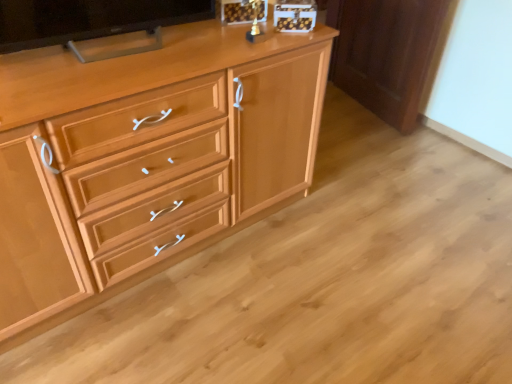
Where is `light wood cabinet at center`? The image size is (512, 384). light wood cabinet at center is located at coordinates (145, 160).

Describe the element at coordinates (89, 19) in the screenshot. I see `matte black tv at upper left` at that location.

Describe the element at coordinates (388, 53) in the screenshot. Image resolution: width=512 pixels, height=384 pixels. I see `light brown wood cabinet at right` at that location.

You are a GUI agent. You are given a task and a screenshot of the screen. Output one action in this format:
    pyautogui.click(x=<x>, y=<y>)
    Task: Click on the light wood cabinet at center
    This screenshot has width=512, height=384.
    Given the screenshot: What is the action you would take?
    pyautogui.click(x=145, y=160)

Is light wood cabinet at center taller or shorter than matte black tv at upper left?

Clearly, light wood cabinet at center is taller compared to matte black tv at upper left.

You are a GUI agent. You are given a task and a screenshot of the screen. Output one action in this format:
    pyautogui.click(x=<x>, y=<y>)
    Task: Click on the television lying above the light wood cabinet at center (from the image's perspective)
    
    Given the screenshot: What is the action you would take?
    pyautogui.click(x=89, y=19)

Are light wood cabinet at center and matte black tv at upper left making contact?

No, light wood cabinet at center is not making contact with matte black tv at upper left.

From the image's perspective, which is below, light brown wood cabinet at right or matte black tv at upper left?

matte black tv at upper left, from the image's perspective.

Is light brown wood cabinet at right directly adjacent to matte black tv at upper left?

light brown wood cabinet at right and matte black tv at upper left are clearly separated.

Based on the photo, how distant is light brown wood cabinet at right from matte black tv at upper left?

They are 1.53 meters apart.

Considering the relative sizes of light brown wood cabinet at right and matte black tv at upper left in the image provided, is light brown wood cabinet at right bigger than matte black tv at upper left?

Yes.

Is point (157, 22) less distant than point (225, 50)?

No, it is behind (225, 50).

Are matte black tv at upper left and light wood cabinet at center located far from each other?

matte black tv at upper left is near light wood cabinet at center, not far away.

How many degrees apart are the facing directions of matte black tv at upper left and light wood cabinet at center?

There is a 7.38-degree angle between the facing directions of matte black tv at upper left and light wood cabinet at center.

Is matte black tv at upper left to the right of light wood cabinet at center from the viewer's perspective?

In fact, matte black tv at upper left is to the left of light wood cabinet at center.

Which is closer, (401, 71) or (198, 132)?

The point (198, 132) is closer.

How many degrees apart are the facing directions of light brown wood cabinet at right and light wood cabinet at center?

101 degrees.

Is light brown wood cabinet at right facing away from light wood cabinet at center?

No, light brown wood cabinet at right is not facing away from light wood cabinet at center.

Consider the image. From a real-world perspective, is light brown wood cabinet at right on light wood cabinet at center?

Actually, light brown wood cabinet at right is physically below light wood cabinet at center in the real world.

Is matte black tv at upper left aimed at light brown wood cabinet at right?

No, matte black tv at upper left is not oriented towards light brown wood cabinet at right.

Is matte black tv at upper left closer to camera compared to light brown wood cabinet at right?

Yes.

Considering the sizes of objects matte black tv at upper left and light brown wood cabinet at right in the image provided, who is bigger, matte black tv at upper left or light brown wood cabinet at right?

With larger size is light brown wood cabinet at right.

Are matte black tv at upper left and light brown wood cabinet at right located far from each other?

matte black tv at upper left is positioned a significant distance from light brown wood cabinet at right.

Do you think light wood cabinet at center is within light brown wood cabinet at right, or outside of it?

light wood cabinet at center is not inside light brown wood cabinet at right, it's outside.

Is light wood cabinet at center not near light brown wood cabinet at right?

That's right, there is a large distance between light wood cabinet at center and light brown wood cabinet at right.

Is light wood cabinet at center at the left side of light brown wood cabinet at right?

Yes, light wood cabinet at center is to the left of light brown wood cabinet at right.

Where is `television above the light wood cabinet at center (from the image's perspective)`? television above the light wood cabinet at center (from the image's perspective) is located at coordinates (89, 19).

Find the location of `cabinetry to the right of matte black tv at upper left`. cabinetry to the right of matte black tv at upper left is located at coordinates (388, 53).

Based on their spatial positions, is light brown wood cabinet at right or matte black tv at upper left closer to light wood cabinet at center?

matte black tv at upper left lies closer to light wood cabinet at center than the other object.

Based on their spatial positions, is light wood cabinet at center or light brown wood cabinet at right further from matte black tv at upper left?

The object further to matte black tv at upper left is light brown wood cabinet at right.

When comparing their distances from light wood cabinet at center, does matte black tv at upper left or light brown wood cabinet at right seem further?

Among the two, light brown wood cabinet at right is located further to light wood cabinet at center.

Based on their spatial positions, is light brown wood cabinet at right or light wood cabinet at center further from matte black tv at upper left?

light brown wood cabinet at right lies further to matte black tv at upper left than the other object.

When comparing their distances from light brown wood cabinet at right, does matte black tv at upper left or light wood cabinet at center seem closer?

light wood cabinet at center is closer to light brown wood cabinet at right.

Which object lies further to the anchor point light brown wood cabinet at right, light wood cabinet at center or matte black tv at upper left?

Based on the image, matte black tv at upper left appears to be further to light brown wood cabinet at right.

Find the location of a particular element. The image size is (512, 384). chest of drawers between matte black tv at upper left and light brown wood cabinet at right from left to right is located at coordinates (145, 160).